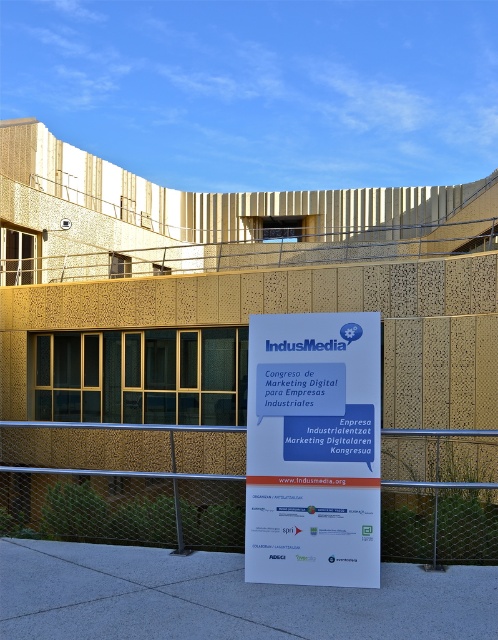
Measure the distance from wire mesh fence at center to white paper sign at center.

wire mesh fence at center and white paper sign at center are 9.61 feet apart.

Between point (42, 458) and point (314, 477), which one is positioned in front?

Point (314, 477)

Is point (381, 442) farther from viewer compared to point (324, 486)?

Yes, point (381, 442) is behind point (324, 486).

Image resolution: width=498 pixels, height=640 pixels. Find the location of `wire mesh fence at center`. wire mesh fence at center is located at coordinates (124, 483).